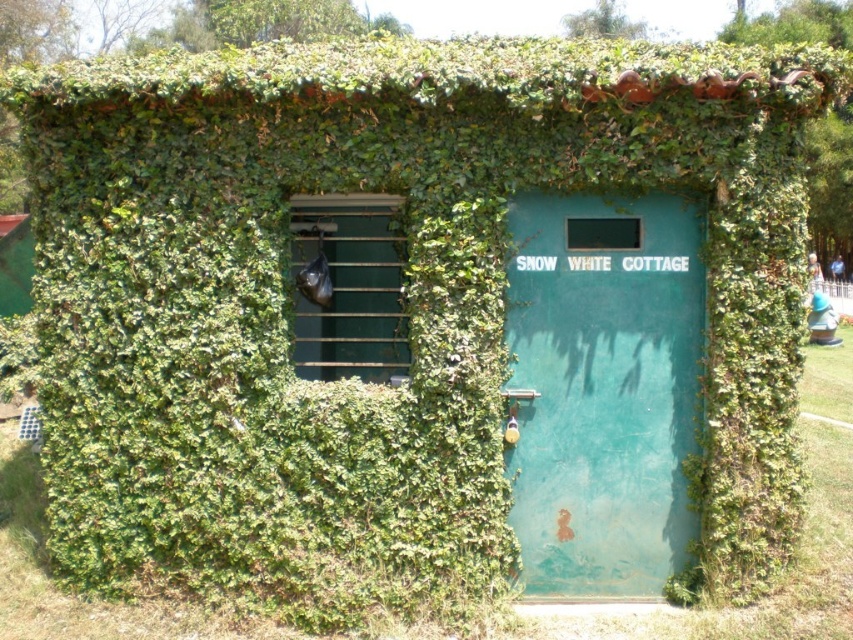
Looking at this image, does black plastic bag at center appear over transparent plastic bag at center?

Actually, black plastic bag at center is below transparent plastic bag at center.

Who is positioned more to the left, black plastic bag at center or transparent plastic bag at center?

From the viewer's perspective, black plastic bag at center appears more on the left side.

Locate an element on the screen. black plastic bag at center is located at coordinates (349, 288).

Identify the location of black plastic bag at center. The height and width of the screenshot is (640, 853). (349, 288).

Does green matte door at center appear under black plastic bag at center?

Indeed, green matte door at center is positioned under black plastic bag at center.

Does point (701, 268) come behind point (320, 225)?

No.

Locate an element on the screen. The width and height of the screenshot is (853, 640). green matte door at center is located at coordinates (602, 394).

Between green matte door at center and transparent plastic bag at center, which one appears on the right side from the viewer's perspective?

green matte door at center

Does green matte door at center appear over transparent plastic bag at center?

No, green matte door at center is not above transparent plastic bag at center.

Where is `green matte door at center`? The image size is (853, 640). green matte door at center is located at coordinates (602, 394).